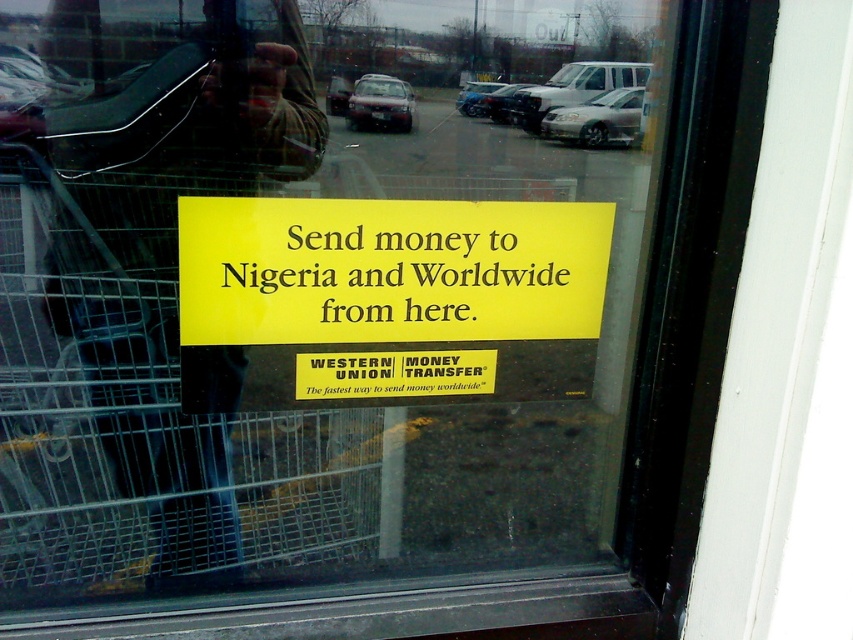
Between yellow matte sign at center and yellow paper sign at center, which one has less height?

yellow paper sign at center is shorter.

Does point (599, 262) come behind point (248, 262)?

Yes, it is behind point (248, 262).

Does point (422, 305) come in front of point (405, 310)?

No.

At what (x,y) coordinates should I click in order to perform the action: click on yellow matte sign at center. Please return your answer as a coordinate pair (x, y). This screenshot has height=640, width=853. Looking at the image, I should click on (387, 300).

Is metallic shopping cart at center to the right of yellow matte sign at center from the viewer's perspective?

In fact, metallic shopping cart at center is to the left of yellow matte sign at center.

Does point (154, 352) lie in front of point (354, 292)?

Yes, point (154, 352) is in front of point (354, 292).

Where is `metallic shopping cart at center`? metallic shopping cart at center is located at coordinates (161, 224).

Is metallic shopping cart at center closer to the viewer compared to yellow paper sign at center?

Yes.

Does metallic shopping cart at center appear under yellow paper sign at center?

Yes, metallic shopping cart at center is below yellow paper sign at center.

I want to click on metallic shopping cart at center, so click(x=161, y=224).